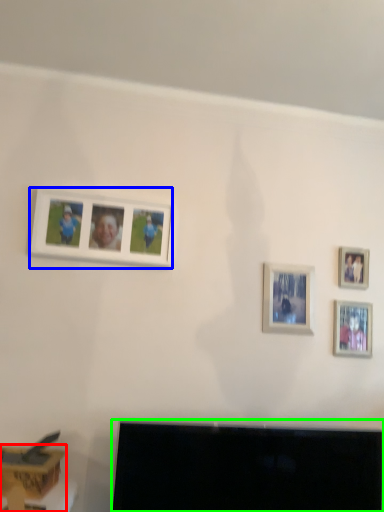
Question: Which object is the farthest from furniture (highlighted by a red box)? Choose among these: picture frame (highlighted by a blue box) or television (highlighted by a green box).

Choices:
 (A) picture frame
 (B) television

Answer: (A)